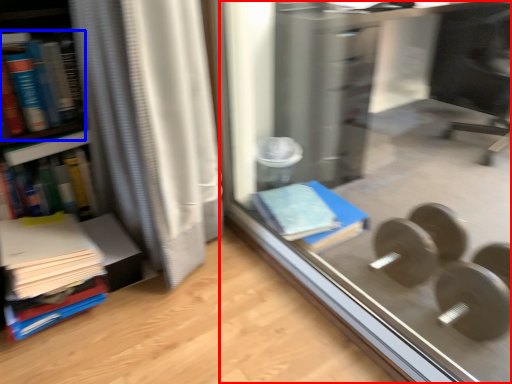
Question: Which object appears farthest to the camera in this image, glass door (highlighted by a red box) or book (highlighted by a blue box)?

Choices:
 (A) glass door
 (B) book

Answer: (B)